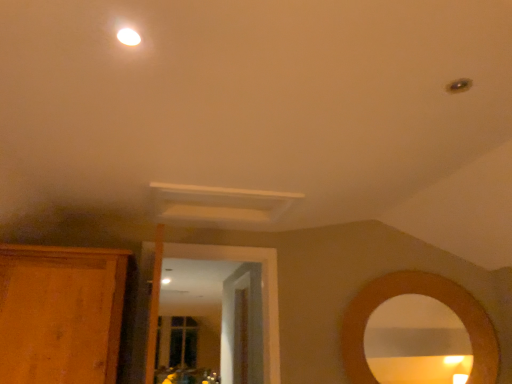
Question: From the image's perspective, relative to wooden cabinet at left, is wooden door at center above or below?

Choices:
 (A) above
 (B) below

Answer: (B)

Question: Is wooden door at center spatially inside wooden cabinet at left, or outside of it?

Choices:
 (A) inside
 (B) outside

Answer: (B)

Question: Which of these objects is positioned closest to the wooden cabinet at left?

Choices:
 (A) white glossy light fixture at upper center
 (B) wooden door at center

Answer: (A)

Question: Estimate the real-world distances between objects in this image. Which object is closer to the wooden cabinet at left?

Choices:
 (A) white glossy light fixture at upper center
 (B) wooden door at center

Answer: (A)